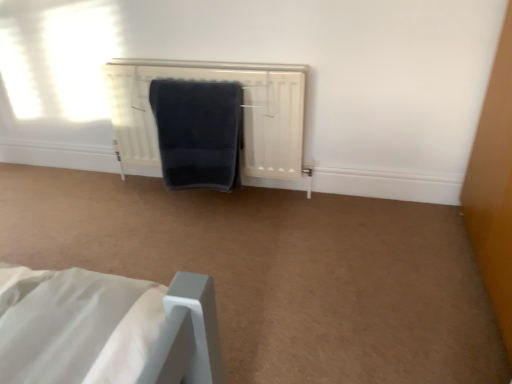
Question: Is white matte radiator at center to the left of dark blue textured towel at center from the viewer's perspective?

Choices:
 (A) no
 (B) yes

Answer: (A)

Question: Is dark blue textured towel at center at the back of white matte radiator at center?

Choices:
 (A) no
 (B) yes

Answer: (B)

Question: From a real-world perspective, is white matte radiator at center on dark blue textured towel at center?

Choices:
 (A) no
 (B) yes

Answer: (A)

Question: From the image's perspective, is white matte radiator at center under dark blue textured towel at center?

Choices:
 (A) yes
 (B) no

Answer: (B)

Question: Can you confirm if white matte radiator at center is bigger than dark blue textured towel at center?

Choices:
 (A) no
 (B) yes

Answer: (B)

Question: Is dark blue textured towel at center a part of white matte radiator at center?

Choices:
 (A) yes
 (B) no

Answer: (A)

Question: From a real-world perspective, does dark blue textured towel at center stand above white matte radiator at center?

Choices:
 (A) yes
 (B) no

Answer: (A)

Question: Is dark blue textured towel at center wider than white matte radiator at center?

Choices:
 (A) no
 (B) yes

Answer: (A)

Question: Considering the relative sizes of dark blue textured towel at center and white matte radiator at center in the image provided, is dark blue textured towel at center smaller than white matte radiator at center?

Choices:
 (A) yes
 (B) no

Answer: (A)

Question: Is dark blue textured towel at center shorter than white matte radiator at center?

Choices:
 (A) no
 (B) yes

Answer: (B)

Question: Is dark blue textured towel at center facing away from white matte radiator at center?

Choices:
 (A) no
 (B) yes

Answer: (B)

Question: Would you consider dark blue textured towel at center to be distant from white matte radiator at center?

Choices:
 (A) no
 (B) yes

Answer: (A)

Question: From the image's perspective, is dark blue textured towel at center positioned above or below white matte radiator at center?

Choices:
 (A) above
 (B) below

Answer: (B)